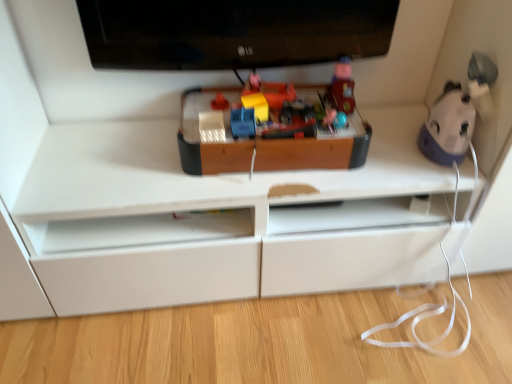
The width and height of the screenshot is (512, 384). I want to click on free space that is to the left of matte plastic toy at center, which ranks as the sixth toy in right-to-left order, so click(x=194, y=105).